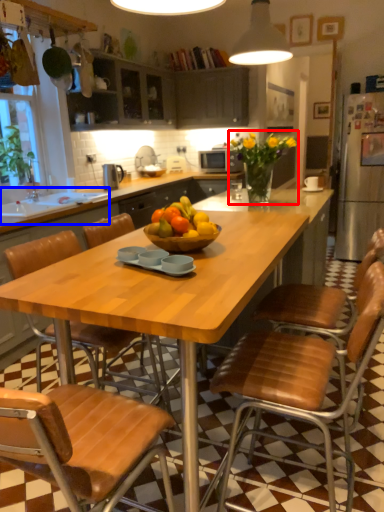
Question: Which of the following is the closest to the observer, flower (highlighted by a red box) or sink (highlighted by a blue box)?

Choices:
 (A) flower
 (B) sink

Answer: (A)